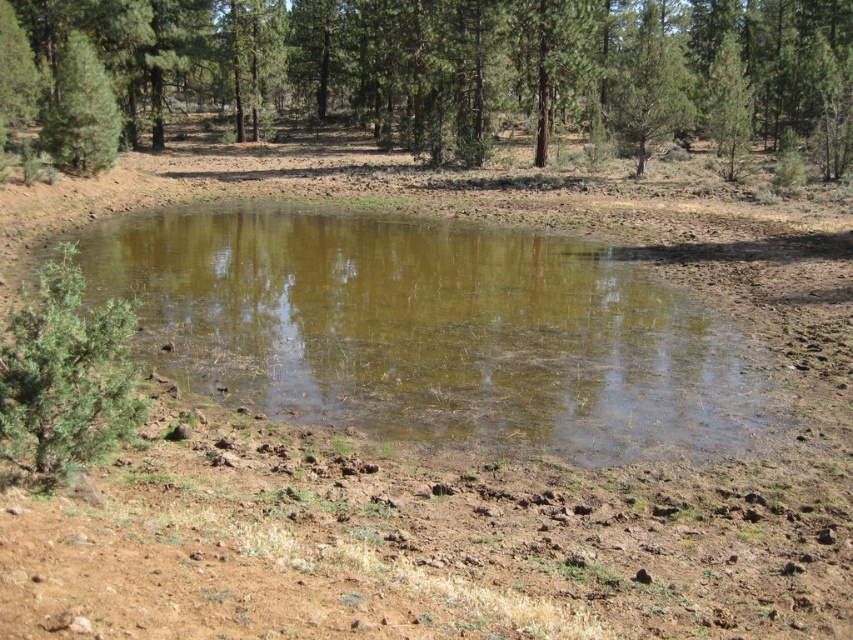
Question: Considering the real-world distances, which object is farthest from the green matte tree at upper right?

Choices:
 (A) green matte tree at upper left
 (B) green matte tree at upper center
 (C) brown murky water at center

Answer: (A)

Question: Which is farther from the green matte tree at upper center?

Choices:
 (A) brown murky water at center
 (B) green textured tree at upper center

Answer: (A)

Question: Can you confirm if brown murky water at center is positioned to the right of green textured tree at upper center?

Choices:
 (A) yes
 (B) no

Answer: (B)

Question: From the image, what is the correct spatial relationship of green textured tree at upper center in relation to green matte tree at upper right?

Choices:
 (A) above
 (B) below

Answer: (A)

Question: Which of the following is the farthest from the observer?

Choices:
 (A) green textured tree at upper center
 (B) green matte tree at upper right
 (C) green matte tree at upper left

Answer: (B)

Question: In this image, where is green matte tree at upper center located relative to green matte tree at upper right?

Choices:
 (A) above
 (B) below

Answer: (A)